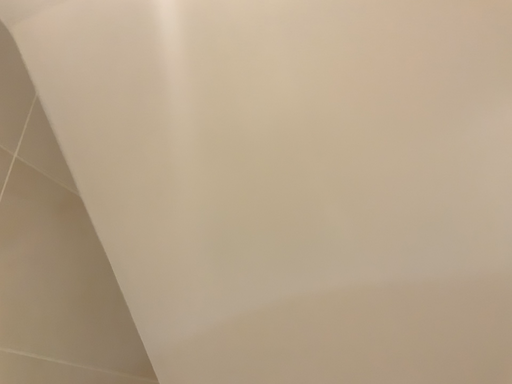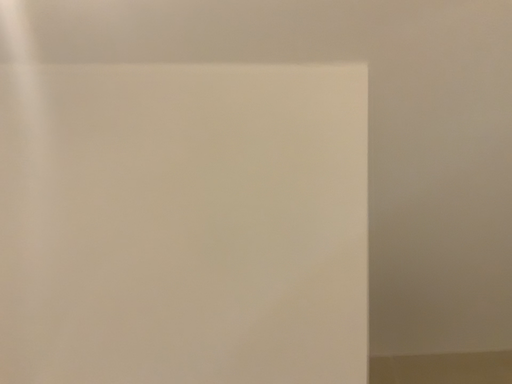
Question: Which way did the camera rotate in the video?

Choices:
 (A) rotated right
 (B) rotated left

Answer: (A)